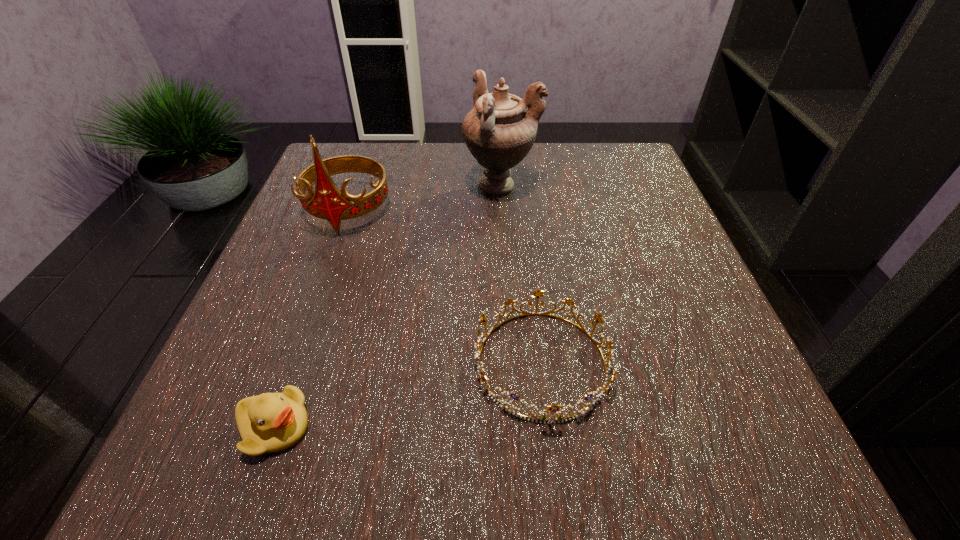
Identify the location of unoccupied area between the duckling and the nearer tiara. Image resolution: width=960 pixels, height=540 pixels. (408, 395).

Identify the location of vacant point located between the duckling and the right tiara. (408, 395).

You are a GUI agent. You are given a task and a screenshot of the screen. Output one action in this format:
    pyautogui.click(x=<x>, y=<y>)
    Task: Click on the unoccupied position between the urn and the right tiara
    
    Given the screenshot: What is the action you would take?
    pyautogui.click(x=521, y=275)

Identify the location of object that is the second closest to the taller tiara. (554, 408).

I want to click on object that stands as the second closest to the nearer tiara, so click(328, 203).